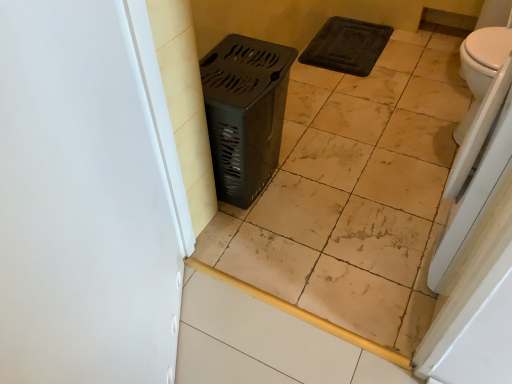
Question: From the image's perspective, is beige ceramic tile at center located beneath white glossy toilet at right?

Choices:
 (A) yes
 (B) no

Answer: (A)

Question: Can you confirm if beige ceramic tile at center is wider than white glossy toilet at right?

Choices:
 (A) no
 (B) yes

Answer: (A)

Question: Considering the relative sizes of beige ceramic tile at center and white glossy toilet at right in the image provided, is beige ceramic tile at center thinner than white glossy toilet at right?

Choices:
 (A) no
 (B) yes

Answer: (B)

Question: From a real-world perspective, does beige ceramic tile at center sit lower than white glossy toilet at right?

Choices:
 (A) no
 (B) yes

Answer: (A)

Question: Can white glossy toilet at right be found inside beige ceramic tile at center?

Choices:
 (A) yes
 (B) no

Answer: (B)

Question: Does beige ceramic tile at center have a greater height compared to white glossy toilet at right?

Choices:
 (A) no
 (B) yes

Answer: (B)

Question: Considering the relative sizes of beige ceramic tile at center and white matte screen door at left in the image provided, is beige ceramic tile at center wider than white matte screen door at left?

Choices:
 (A) no
 (B) yes

Answer: (B)

Question: From the image's perspective, is beige ceramic tile at center below white matte screen door at left?

Choices:
 (A) no
 (B) yes

Answer: (A)

Question: Is beige ceramic tile at center not near white matte screen door at left?

Choices:
 (A) no
 (B) yes

Answer: (A)

Question: Could you tell me if beige ceramic tile at center is turned towards white matte screen door at left?

Choices:
 (A) yes
 (B) no

Answer: (A)

Question: Considering the relative positions of beige ceramic tile at center and white matte screen door at left in the image provided, is beige ceramic tile at center behind white matte screen door at left?

Choices:
 (A) yes
 (B) no

Answer: (A)

Question: Is beige ceramic tile at center looking in the opposite direction of white matte screen door at left?

Choices:
 (A) no
 (B) yes

Answer: (B)

Question: Is beige ceramic tile at center inside white matte screen door at left?

Choices:
 (A) yes
 (B) no

Answer: (B)